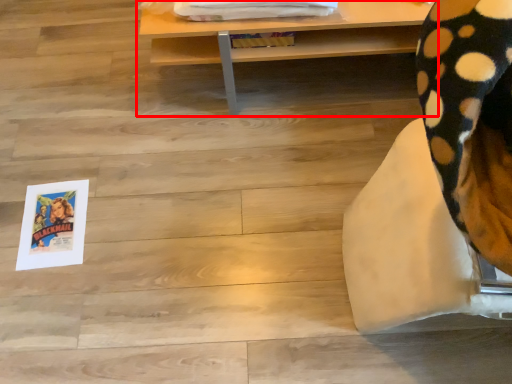
Question: In this image, where is table (annotated by the red box) located relative to furniture?

Choices:
 (A) right
 (B) left

Answer: (B)